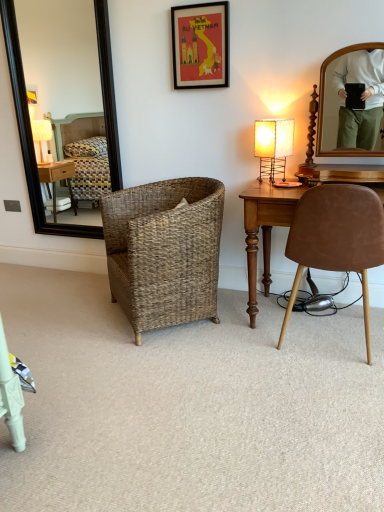
This screenshot has width=384, height=512. I want to click on brown suede chair at right, arranged as the first chair when viewed from the right, so click(x=336, y=239).

Describe the element at coordinates (200, 45) in the screenshot. I see `red paper picture frame at upper center` at that location.

What is the approximate width of black framed mirror at left?

black framed mirror at left is 2.05 inches wide.

Locate an element on the screen. matte beige lamp at right is located at coordinates (273, 146).

Does point (94, 0) appear closer or farther from the camera than point (175, 42)?

Point (94, 0) is positioned farther from the camera compared to point (175, 42).

Would you say black framed mirror at left is a long distance from red paper picture frame at upper center?

Yes, black framed mirror at left is far from red paper picture frame at upper center.

Considering their positions, is black framed mirror at left located in front of or behind red paper picture frame at upper center?

Clearly, black framed mirror at left is behind red paper picture frame at upper center.

Who is smaller, black framed mirror at left or red paper picture frame at upper center?

red paper picture frame at upper center.

Consider the image. In terms of size, does brown suede chair at right, the 2th chair when ordered from left to right, appear bigger or smaller than black framed mirror at left?

In the image, brown suede chair at right, the 2th chair when ordered from left to right, appears to be larger than black framed mirror at left.

Is brown suede chair at right, the 2th chair when ordered from left to right, aimed at black framed mirror at left?

No, brown suede chair at right, the 2th chair when ordered from left to right, is not turned towards black framed mirror at left.

Is brown suede chair at right, the 2th chair when ordered from left to right, directly adjacent to black framed mirror at left?

They are not placed beside each other.

In the image, is brown suede chair at right, the 2th chair when ordered from left to right, positioned in front of or behind black framed mirror at left?

brown suede chair at right, the 2th chair when ordered from left to right, is positioned closer to the viewer than black framed mirror at left.

Find the location of a particular element. This screenshot has height=512, width=384. lamp above the woven brown basket at center, which ranks as the second chair in right-to-left order (from the image's perspective) is located at coordinates (273, 146).

Is matte beige lamp at right looking in the opposite direction of woven brown basket at center, which ranks as the second chair in right-to-left order?

No, matte beige lamp at right's orientation is not away from woven brown basket at center, which ranks as the second chair in right-to-left order.

Could you measure the distance between matte beige lamp at right and woven brown basket at center, which ranks as the second chair in right-to-left order?

They are 26.16 inches apart.

Is point (281, 129) behind point (142, 231)?

Yes.

Considering the positions of objects red paper picture frame at upper center and woven basket at center in the image provided, who is behind, red paper picture frame at upper center or woven basket at center?

red paper picture frame at upper center.

Between red paper picture frame at upper center and woven basket at center, which one has smaller size?

With smaller size is red paper picture frame at upper center.

Is red paper picture frame at upper center surrounding woven basket at center?

Actually, woven basket at center is outside red paper picture frame at upper center.

Is red paper picture frame at upper center to the left or to the right of woven basket at center in the image?

red paper picture frame at upper center is to the right of woven basket at center.

Does point (213, 55) appear closer or farther from the camera than point (86, 230)?

Point (213, 55).

Is red paper picture frame at upper center positioned with its back to black framed mirror at left?

No, red paper picture frame at upper center is not facing away from black framed mirror at left.

How different are the orientations of red paper picture frame at upper center and black framed mirror at left in degrees?

red paper picture frame at upper center and black framed mirror at left are facing 0.00876 degrees away from each other.

From a real-world perspective, which object rests below the other?

black framed mirror at left.

Is woven brown basket at center, which ranks as the second chair in right-to-left order, completely or partially outside of brown suede chair at right, the 2th chair when ordered from left to right?

Yes, woven brown basket at center, which ranks as the second chair in right-to-left order, is not within brown suede chair at right, the 2th chair when ordered from left to right.

Which object is positioned more to the left, woven brown basket at center, which ranks as the second chair in right-to-left order, or brown suede chair at right, the 2th chair when ordered from left to right?

woven brown basket at center, which ranks as the second chair in right-to-left order, is more to the left.

From a real-world perspective, which object stands above the other?

brown suede chair at right, arranged as the first chair when viewed from the right, is physically above.

From the image's perspective, which is above, woven brown basket at center, which ranks as the second chair in right-to-left order, or brown suede chair at right, the 2th chair when ordered from left to right?

woven brown basket at center, which ranks as the second chair in right-to-left order, is shown above in the image.

Which is less distant, (341, 257) or (218, 46)?

The point (341, 257) is closer to the camera.

Is brown suede chair at right, arranged as the first chair when viewed from the right, oriented towards red paper picture frame at upper center?

No.

Can you confirm if brown suede chair at right, arranged as the first chair when viewed from the right, is positioned to the left of red paper picture frame at upper center?

No.

In the image, there is a red paper picture frame at upper center. Identify the location of mirror below it (from the image's perspective). The image size is (384, 512). (30, 132).

At what (x,y) coordinates should I click in order to perform the action: click on mirror behind the brown suede chair at right, the 2th chair when ordered from left to right. Please return your answer as a coordinate pair (x, y). This screenshot has width=384, height=512. Looking at the image, I should click on (30, 132).

Based on their spatial positions, is black framed mirror at left or red paper picture frame at upper center closer to matte beige lamp at right?

red paper picture frame at upper center is positioned closer to the anchor matte beige lamp at right.

When comparing their distances from woven basket at center, does black framed mirror at left or brown suede chair at right, the 2th chair when ordered from left to right, seem further?

black framed mirror at left lies further to woven basket at center than the other object.

From the picture: When comparing their distances from black framed mirror at left, does woven basket at center or woven brown basket at center, which is the 1th chair from left to right, seem closer?

woven brown basket at center, which is the 1th chair from left to right, lies closer to black framed mirror at left than the other object.

Based on their spatial positions, is black framed mirror at left or matte beige lamp at right further from red paper picture frame at upper center?

Among the two, black framed mirror at left is located further to red paper picture frame at upper center.

In the scene shown: Considering their positions, is woven brown basket at center, which ranks as the second chair in right-to-left order, positioned further to matte beige lamp at right than black framed mirror at left?

black framed mirror at left.

When comparing their distances from woven brown basket at center, which is the 1th chair from left to right, does red paper picture frame at upper center or matte beige lamp at right seem further?

red paper picture frame at upper center lies further to woven brown basket at center, which is the 1th chair from left to right, than the other object.

Looking at the image, which one is located closer to woven brown basket at center, which is the 1th chair from left to right, black framed mirror at left or red paper picture frame at upper center?

red paper picture frame at upper center is closer to woven brown basket at center, which is the 1th chair from left to right.

Consider the image. From the image, which object appears to be nearer to woven brown basket at center, which is the 1th chair from left to right, woven basket at center or black framed mirror at left?

woven basket at center.

You are a GUI agent. You are given a task and a screenshot of the screen. Output one action in this format:
    pyautogui.click(x=<x>, y=<y>)
    Task: Click on the chair that lies between red paper picture frame at upper center and brown suede chair at right, arranged as the first chair when viewed from the right, from top to bottom
    This screenshot has width=384, height=512.
    Given the screenshot: What is the action you would take?
    pyautogui.click(x=164, y=251)

I want to click on mirror between red paper picture frame at upper center and woven basket at center in the up-down direction, so [x=30, y=132].

Identify the location of mirror that lies between red paper picture frame at upper center and woven brown basket at center, which is the 1th chair from left to right, from top to bottom. The width and height of the screenshot is (384, 512). (30, 132).

Locate an element on the screen. This screenshot has width=384, height=512. lamp positioned between woven basket at center and black framed mirror at left from near to far is located at coordinates (273, 146).